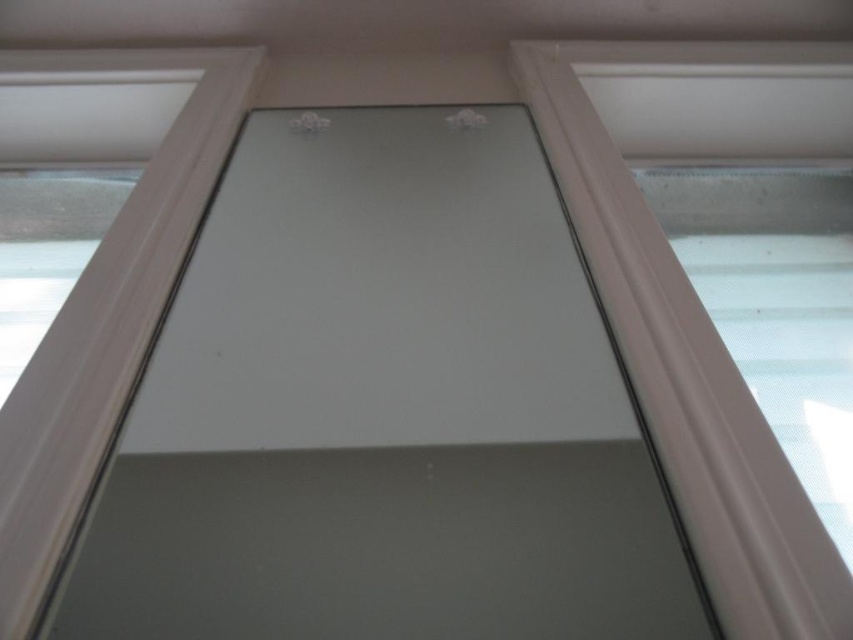
You are standing in front of the frosted glass door with a white frame. You notice two points marked on the door. One is at coordinate point (706, 531) and the other at point (33, 545). Which point is closer to the bottom edge of the door?

Point (706, 531) is closer to the bottom edge of the door because it is positioned lower on the door compared to point (33, 545).

You are designing a new window and need to know the size relationship between the white plastic window frame at right and the white plastic window frame at upper left. Which one is larger?

The white plastic window frame at right is bigger than the white plastic window frame at upper left according to the description.

From the picture: You are standing in front of the frosted glass door with a white frame. There is a point at (x=639, y=220). Can you reach this point with your hand if your arm can extend 36 inches?

The point at (x=639, y=220) is 35.43 inches away from you, so yes, you can reach it with your hand since your arm can extend 36 inches.